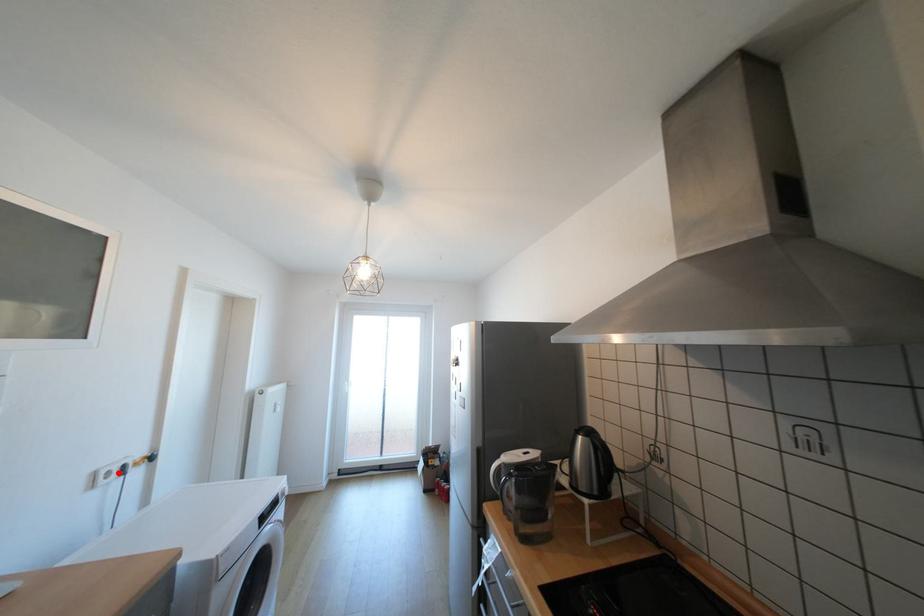
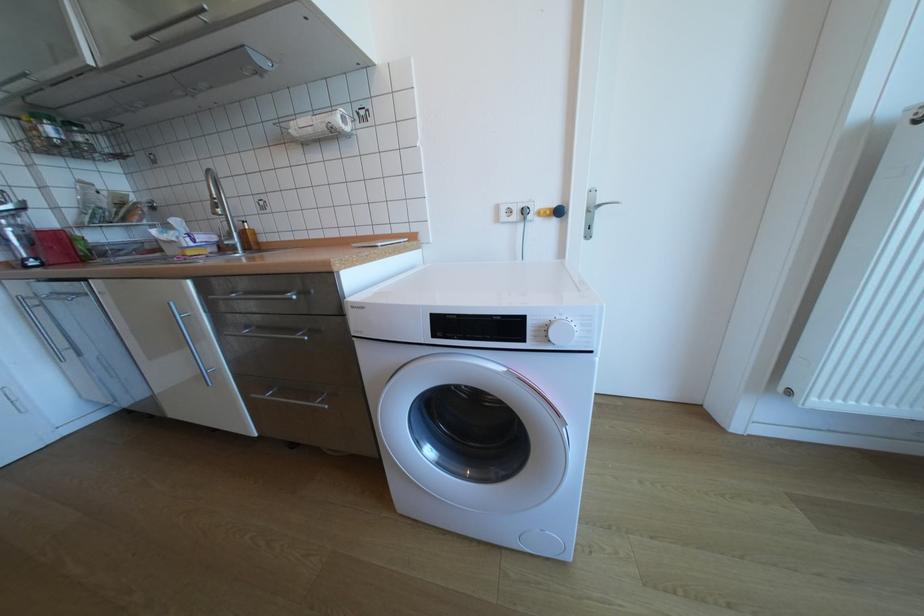
Locate, in the second image, the point that corresponds to the highlighted location in the first image.

(518, 211)